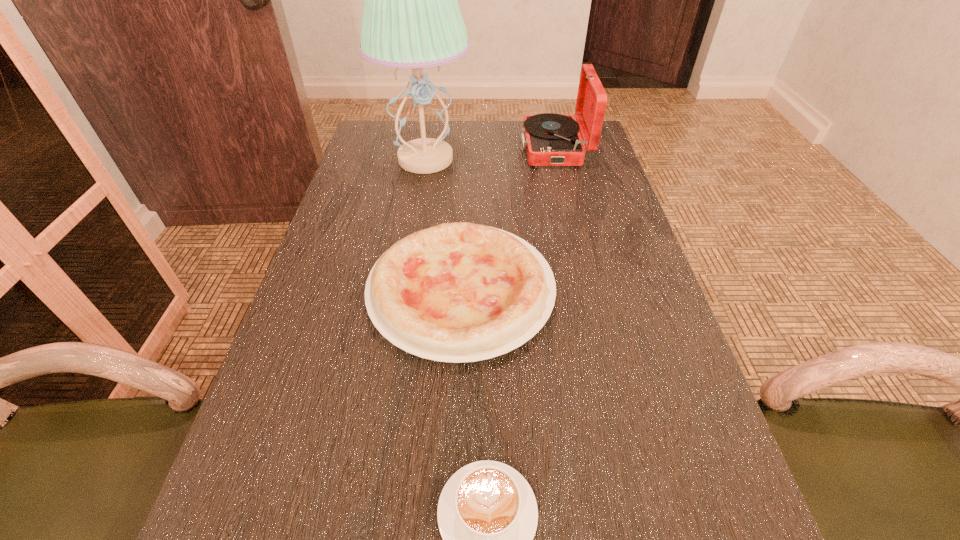
At what (x,y) coordinates should I click in order to perform the action: click on lamp that is at the left edge. Please return your answer as a coordinate pair (x, y). This screenshot has width=960, height=540. Looking at the image, I should click on (411, 18).

Find the location of a particular element. The image size is (960, 540). pizza located in the left edge section of the desktop is located at coordinates (457, 292).

This screenshot has height=540, width=960. In order to click on object that is at the right edge in this screenshot , I will do `click(550, 139)`.

This screenshot has height=540, width=960. Find the location of `object positioned at the far left corner`. object positioned at the far left corner is located at coordinates (411, 18).

I want to click on object present at the far right corner, so click(x=550, y=139).

Find the location of a particular element. vacant space at the left edge of the desktop is located at coordinates (311, 480).

Find the location of a particular element. The image size is (960, 540). vacant space at the right edge of the desktop is located at coordinates (615, 199).

Locate an element on the screen. vacant space at the far left corner of the desktop is located at coordinates (386, 137).

At what (x,y) coordinates should I click in order to perform the action: click on vacant space that is in between the phonograph_record and the third farthest object. Please return your answer as a coordinate pair (x, y). The height and width of the screenshot is (540, 960). Looking at the image, I should click on (508, 220).

Locate an element on the screen. vacant space in between the phonograph_record and the tallest object is located at coordinates (491, 154).